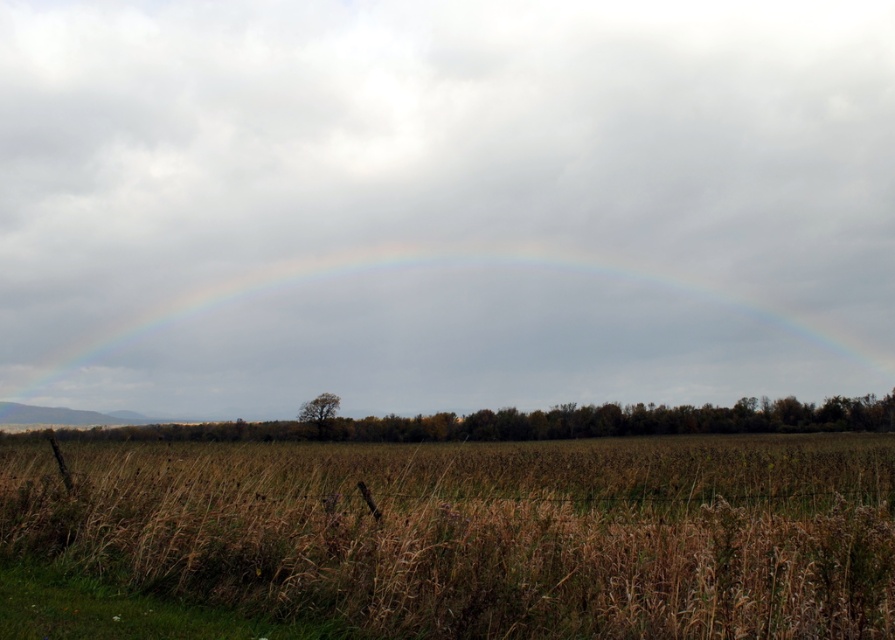
Question: Is the position of brown grass at lower center less distant than that of rainbow at center?

Choices:
 (A) no
 (B) yes

Answer: (B)

Question: Considering the relative positions of brown grass at lower center and rainbow at center in the image provided, where is brown grass at lower center located with respect to rainbow at center?

Choices:
 (A) above
 (B) below

Answer: (B)

Question: Is brown grass at lower center to the left of rainbow at center from the viewer's perspective?

Choices:
 (A) yes
 (B) no

Answer: (A)

Question: Which point is farther to the camera?

Choices:
 (A) rainbow at center
 (B) brown grass at lower center

Answer: (A)

Question: Which object appears farthest from the camera in this image?

Choices:
 (A) rainbow at center
 (B) brown grass at lower center

Answer: (A)